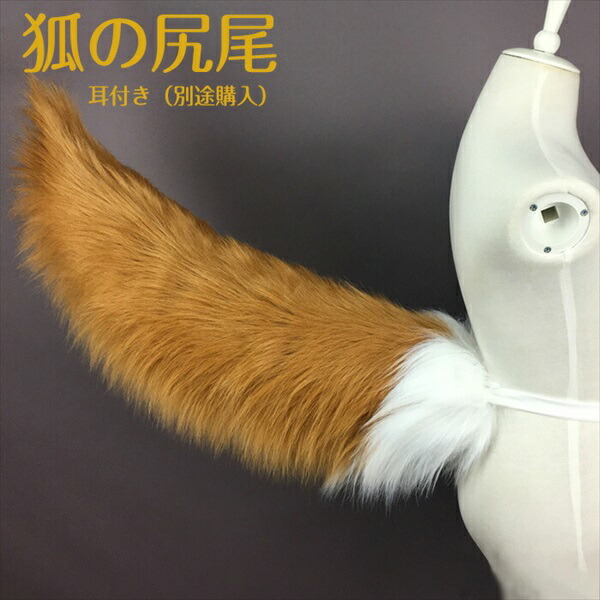
Locate an element on the screen. gray wall is located at coordinates click(x=366, y=92).